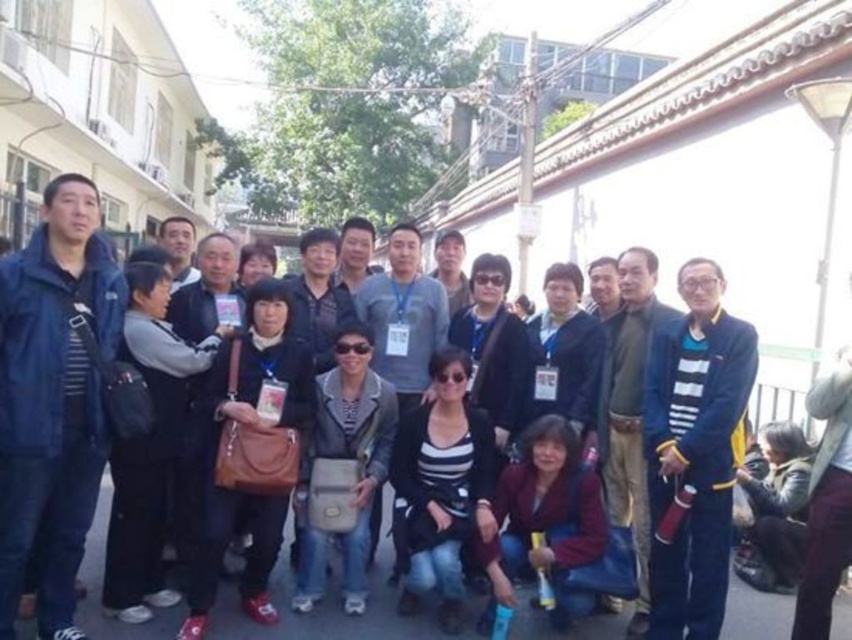
Does dark red fabric jacket at lower center have a lesser height compared to leather-like gray bag at center?

Yes, dark red fabric jacket at lower center is shorter than leather-like gray bag at center.

Image resolution: width=852 pixels, height=640 pixels. What are the coordinates of `dark red fabric jacket at lower center` in the screenshot? It's located at (545, 518).

Describe the element at coordinates (545, 518) in the screenshot. I see `dark red fabric jacket at lower center` at that location.

Locate an element on the screen. This screenshot has width=852, height=640. dark red fabric jacket at lower center is located at coordinates (545, 518).

Is black striped shirt at center positioned in front of leather-like gray bag at center?

Yes.

Is point (473, 438) farther from viewer compared to point (350, 595)?

Yes, it is behind point (350, 595).

Locate an element on the screen. This screenshot has height=640, width=852. black striped shirt at center is located at coordinates coord(442,486).

Which is above, black striped shirt at center or dark red fabric jacket at lower center?

black striped shirt at center

Can you confirm if black striped shirt at center is positioned to the left of dark red fabric jacket at lower center?

Indeed, black striped shirt at center is positioned on the left side of dark red fabric jacket at lower center.

Which is in front, point (448, 376) or point (576, 609)?

Positioned in front is point (576, 609).

This screenshot has width=852, height=640. I want to click on black striped shirt at center, so click(x=442, y=486).